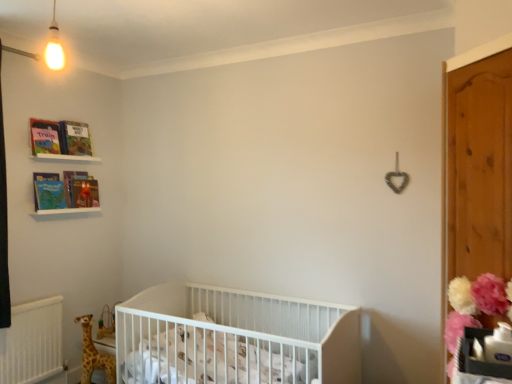
Question: From a real-world perspective, does matte paper book at upper left, which ranks as the 2th magazine in top-to-bottom order, sit lower than matte paper book at upper left, which is the second magazine from back to front?

Choices:
 (A) yes
 (B) no

Answer: (A)

Question: Is matte paper book at upper left, the 1th magazine positioned from the back, to the left of matte paper book at upper left, which is the second magazine from back to front, from the viewer's perspective?

Choices:
 (A) yes
 (B) no

Answer: (B)

Question: Is matte paper book at upper left, the 1th magazine positioned from the back, surrounding matte paper book at upper left, the second magazine ordered from the bottom?

Choices:
 (A) no
 (B) yes

Answer: (A)

Question: From the image's perspective, does matte paper book at upper left, which ranks as the 2th magazine in top-to-bottom order, appear higher than matte paper book at upper left, which is the second magazine from back to front?

Choices:
 (A) yes
 (B) no

Answer: (B)

Question: Can you confirm if matte paper book at upper left, which is counted as the 2th magazine, starting from the front, is shorter than matte paper book at upper left, which is the second magazine from back to front?

Choices:
 (A) yes
 (B) no

Answer: (B)

Question: Is matte paper book at upper left, the 1th magazine positioned from the back, positioned beyond the bounds of matte paper book at upper left, which appears as the first magazine when viewed from the top?

Choices:
 (A) yes
 (B) no

Answer: (A)

Question: From the image's perspective, is matte cardboard book at upper left, the first book from the top, located above white matte crib at center?

Choices:
 (A) no
 (B) yes

Answer: (B)

Question: Considering the relative sizes of matte cardboard book at upper left, arranged as the second book when ordered from the bottom, and white matte crib at center in the image provided, is matte cardboard book at upper left, arranged as the second book when ordered from the bottom, bigger than white matte crib at center?

Choices:
 (A) no
 (B) yes

Answer: (A)

Question: From a real-world perspective, is matte cardboard book at upper left, the first book from the top, on white matte crib at center?

Choices:
 (A) no
 (B) yes

Answer: (B)

Question: From the image's perspective, is matte cardboard book at upper left, the first book from the top, under white matte crib at center?

Choices:
 (A) yes
 (B) no

Answer: (B)

Question: Considering the relative positions of matte cardboard book at upper left, arranged as the second book when ordered from the bottom, and white matte crib at center in the image provided, is matte cardboard book at upper left, arranged as the second book when ordered from the bottom, behind white matte crib at center?

Choices:
 (A) no
 (B) yes

Answer: (B)

Question: From a real-world perspective, is matte cardboard book at upper left, the first book from the top, beneath white matte crib at center?

Choices:
 (A) yes
 (B) no

Answer: (B)

Question: Does matte paper book at upper left, positioned as the 1th magazine in bottom-to-top order, appear on the right side of spotted fabric giraffe at lower left?

Choices:
 (A) yes
 (B) no

Answer: (B)